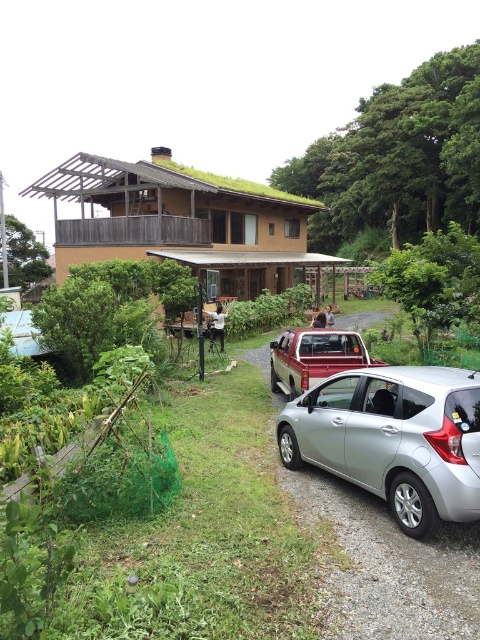
You are a delivery person arriving at this house and need to park your van behind the silver metallic sedan at center. Is there enough space behind the silver metallic car at center for your van, considering the silver metallic car at lower right is blocking part of the driveway?

The silver metallic car at lower right is in front of the silver metallic sedan at center, so there is no space behind the silver metallic sedan at center to park your van as it is blocked by the silver metallic car at lower right.

You are standing at the edge of the gravel driveway in front of the house. You see two points marked on the ground. Which point is closer to you, point [256,353] or point [280,380]?

Point [256,353] is further to the viewer than point [280,380], so the closer point to you is point [280,380].